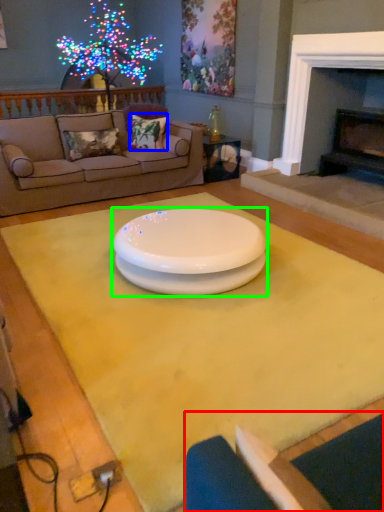
Question: Which is nearer to the armchair (highlighted by a red box)? pillow (highlighted by a blue box) or coffee table (highlighted by a green box).

Choices:
 (A) pillow
 (B) coffee table

Answer: (B)